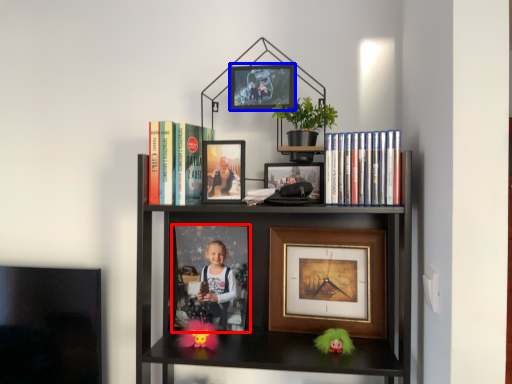
Question: Which object appears farthest to the camera in this image, picture frame (highlighted by a red box) or picture frame (highlighted by a blue box)?

Choices:
 (A) picture frame
 (B) picture frame

Answer: (A)